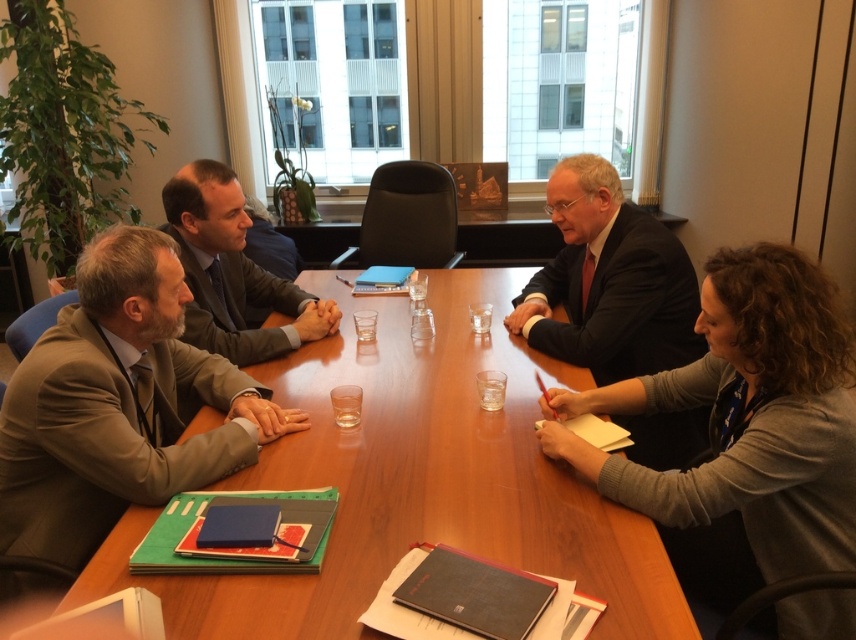
You are a server bringing a tray of drinks to the conference room. You need to place a drink for the person in the gray fabric sweater at lower right and the person in the dark suit at center. If your tray can only hold items within a 24 inch radius, will you be able to serve both without moving the tray?

The distance between the gray fabric sweater at lower right and the dark suit at center is 23.91 inches, which is within the 24 inch radius. Therefore, you can serve both individuals without moving the tray.

In the conference room scene, there are two individuals wearing suits. One is wearing a matte brown suit at left and the other a matte gray suit at center. From the perspective of someone sitting at the head of the table, which suit is positioned to the right of the other?

The matte brown suit at left is to the right of the matte gray suit at center.

From the picture: You are standing in the conference room and want to reach the point at coordinates point (580, 449). If your arm length is 0.7 meters, can you reach that point without moving your feet?

The distance between you and the point (580, 449) is 1.54 meters. Since your arm length is only 0.7 meters, you cannot reach it without moving your feet.